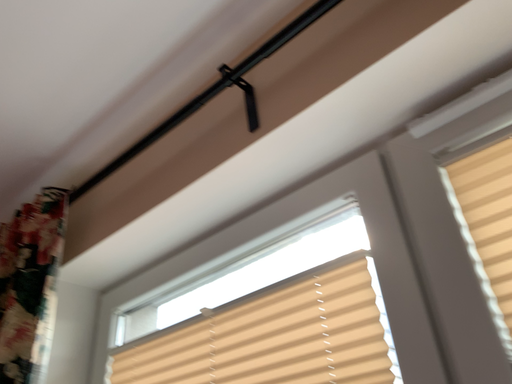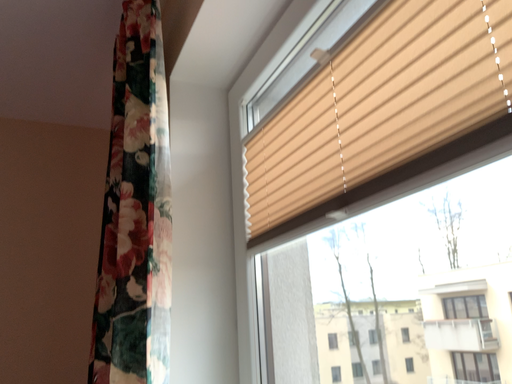
Question: How did the camera likely rotate when shooting the video?

Choices:
 (A) rotated upward
 (B) rotated downward

Answer: (B)